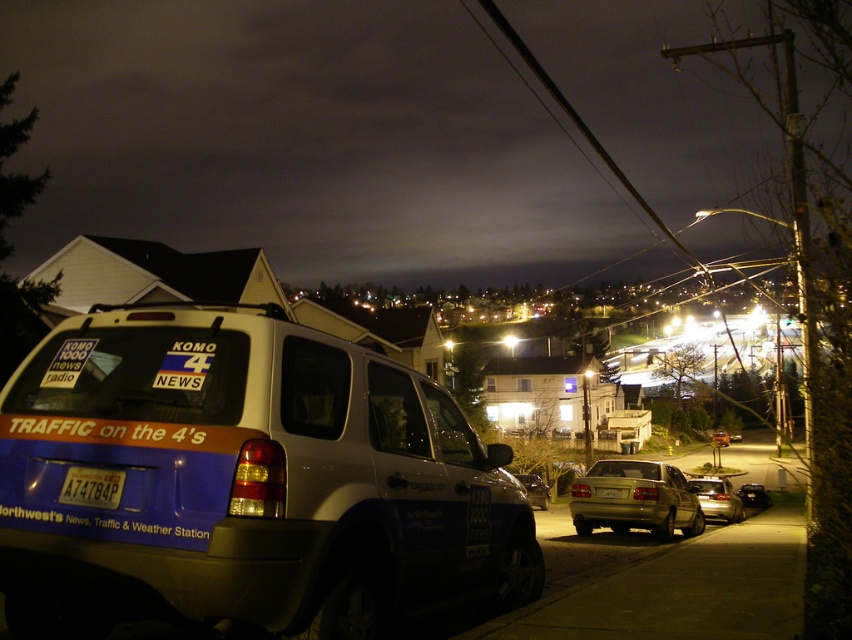
You are a delivery driver who needs to park your truck at the same location as the silver metallic minivan at center. What are the coordinates where you should park your truck?

The silver metallic minivan at center is located at coordinates point (245, 481), so you should park your truck at those coordinates.

You are a delivery driver who needs to park your delivery van, which is 20 feet long, behind the silver metallic sedan at center. The parking space behind the sedan can only accommodate vehicles up to 25 feet in length. Is your van too long to fit in the space?

The silver metallic sedan at center is 68.61 feet away from the camera, but this distance does not indicate the length of the parking space. The question about the van fitting cannot be determined based on the provided information.

You are a delivery driver who needs to park your car behind the silver metallic sedan at center without blocking the license plate. Can you park your car so that your vehicle doesn not cover the white plastic license plate at center?

The silver metallic sedan at center is bigger than the white plastic license plate at center, so if you park behind it, the license plate will be visible and your car won not block it.